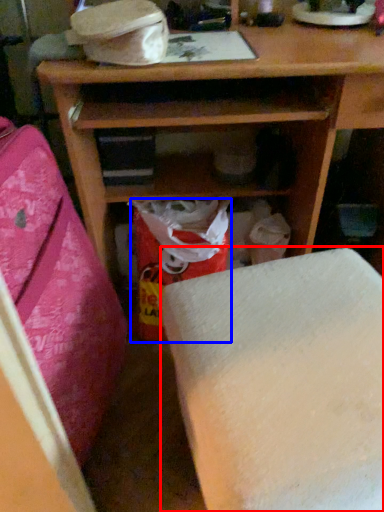
Question: Which of the following is the closest to the observer, furniture (highlighted by a red box) or shopping bag (highlighted by a blue box)?

Choices:
 (A) furniture
 (B) shopping bag

Answer: (A)